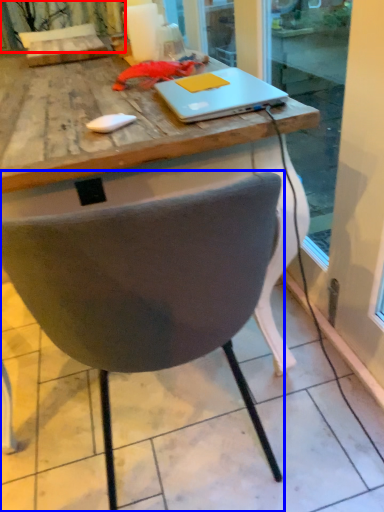
Question: Which object appears closest to the camera in this image, curtain (highlighted by a red box) or chair (highlighted by a blue box)?

Choices:
 (A) curtain
 (B) chair

Answer: (B)